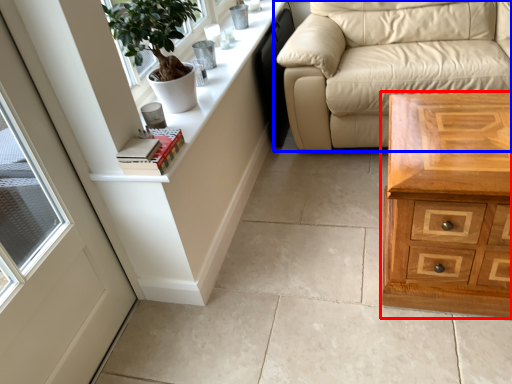
Question: Among these objects, which one is nearest to the camera, chest of drawers (highlighted by a red box) or studio couch (highlighted by a blue box)?

Choices:
 (A) chest of drawers
 (B) studio couch

Answer: (A)